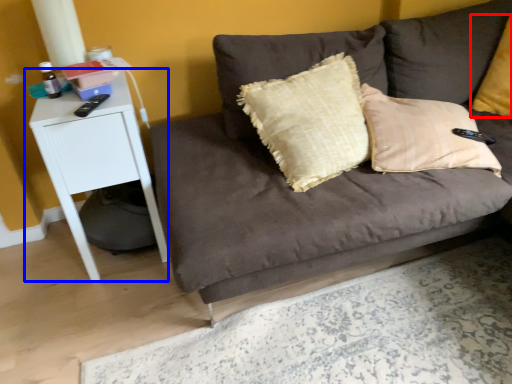
Question: Which of the following is the closest to the observer, pillow (highlighted by a red box) or table (highlighted by a blue box)?

Choices:
 (A) pillow
 (B) table

Answer: (B)